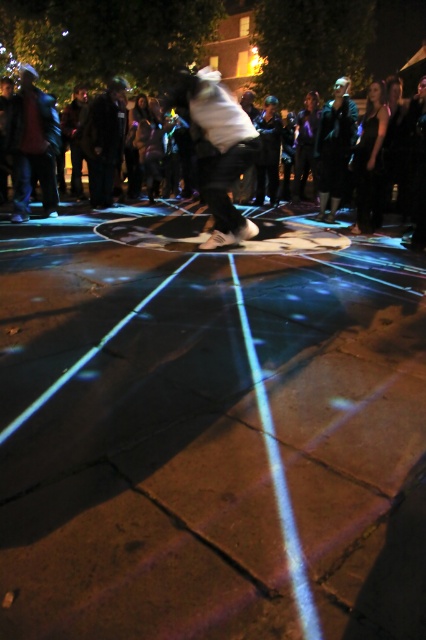
Between black leather jacket at upper center and matte black jacket at left, which one appears on the left side from the viewer's perspective?

Positioned to the left is matte black jacket at left.

Does point (207, 184) come farther from viewer compared to point (31, 115)?

No, (207, 184) is in front of (31, 115).

Which is behind, point (207, 202) or point (58, 136)?

The point (58, 136) is behind.

What are the coordinates of `black leather jacket at upper center` in the screenshot? It's located at (219, 152).

Between brown concrete pavement at center and matte black jacket at left, which one has less height?

With less height is brown concrete pavement at center.

Which is below, brown concrete pavement at center or matte black jacket at left?

Positioned lower is brown concrete pavement at center.

Between point (89, 552) and point (28, 72), which one is positioned in front?

Point (89, 552) is in front.

What are the coordinates of `brown concrete pavement at center` in the screenshot? It's located at (210, 429).

Find the location of a particular element. The image size is (426, 640). black leather jacket at upper center is located at coordinates (219, 152).

Locate an element on the screen. This screenshot has height=640, width=426. black leather jacket at upper center is located at coordinates (219, 152).

Where is `black leather jacket at upper center`? The width and height of the screenshot is (426, 640). black leather jacket at upper center is located at coordinates (219, 152).